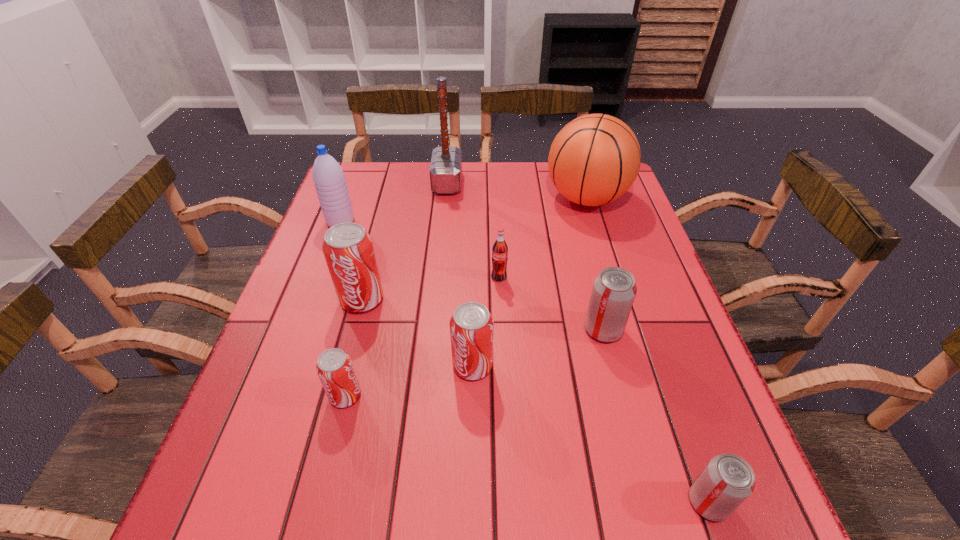
You are a GUI agent. You are given a task and a screenshot of the screen. Output one action in this format:
    pyautogui.click(x=<x>, y=<y>)
    Task: Click on the free space located 0.220m on the back of the farther gray soda can
    The height and width of the screenshot is (540, 960).
    Given the screenshot: What is the action you would take?
    pyautogui.click(x=583, y=252)

You are a GUI agent. You are given a task and a screenshot of the screen. Output one action in this format:
    pyautogui.click(x=<x>, y=<y>)
    Task: Click on the blank space located on the logo side of the rightmost red soda can
    The width and height of the screenshot is (960, 540).
    Given the screenshot: What is the action you would take?
    pyautogui.click(x=601, y=366)

The width and height of the screenshot is (960, 540). I want to click on vacant space located on the label of the fourth farthest object, so click(503, 379).

In order to click on free region located on the logo side of the smallest red soda can in this screenshot , I will do `click(564, 396)`.

Find the location of a particular element. The height and width of the screenshot is (540, 960). vacant space located on the left of the rightmost soda can is located at coordinates (539, 502).

Find the location of a particular element. The width and height of the screenshot is (960, 540). hammer that is at the far edge is located at coordinates (445, 170).

The width and height of the screenshot is (960, 540). I want to click on basketball at the far edge, so click(594, 159).

Where is `object that is at the near edge`? object that is at the near edge is located at coordinates (728, 480).

Where is `water bottle that is at the left edge`? The image size is (960, 540). water bottle that is at the left edge is located at coordinates (329, 179).

Identify the location of basketball present at the right edge. Image resolution: width=960 pixels, height=540 pixels. (594, 159).